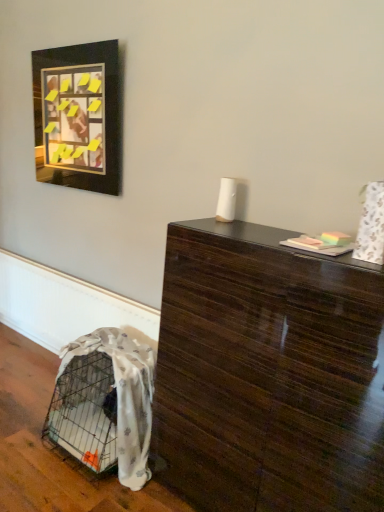
Question: From the image's perspective, is glossy dark wood table at center positioned above or below white textured blanket at lower left?

Choices:
 (A) below
 (B) above

Answer: (B)

Question: Choose the correct answer: Is glossy dark wood table at center inside white textured blanket at lower left or outside it?

Choices:
 (A) inside
 (B) outside

Answer: (B)

Question: Considering the real-world distances, which object is closest to the white textured blanket at lower left?

Choices:
 (A) black matte picture frame at upper left
 (B) glossy dark wood table at center

Answer: (B)

Question: Estimate the real-world distances between objects in this image. Which object is farther from the glossy dark wood table at center?

Choices:
 (A) white textured blanket at lower left
 (B) black matte picture frame at upper left

Answer: (B)